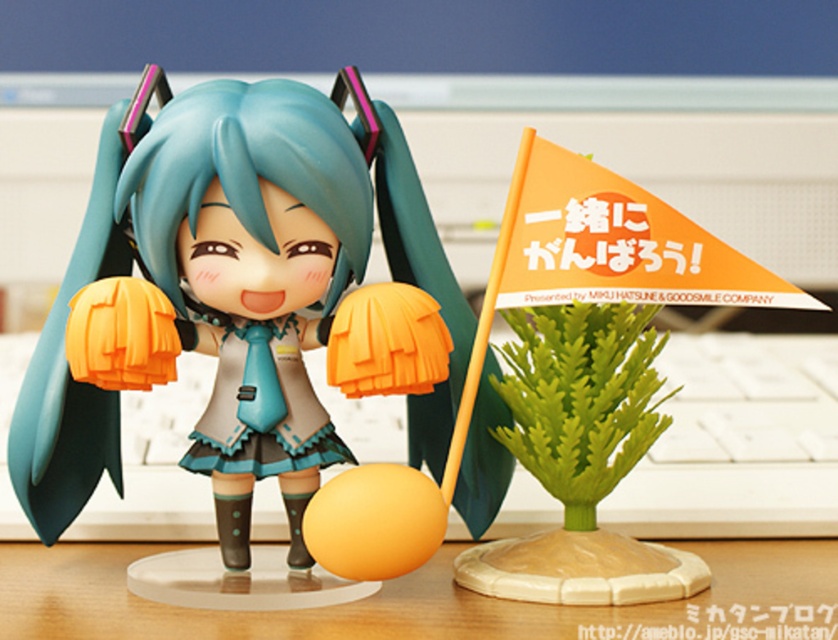
Question: Does matte plastic doll at center have a larger size compared to wooden table at center?

Choices:
 (A) no
 (B) yes

Answer: (B)

Question: Observing the image, what is the correct spatial positioning of matte plastic doll at center in reference to wooden table at center?

Choices:
 (A) right
 (B) left

Answer: (B)

Question: Among these points, which one is farthest from the camera?

Choices:
 (A) (76, 346)
 (B) (747, 628)

Answer: (A)

Question: Is matte plastic doll at center to the left of wooden table at center from the viewer's perspective?

Choices:
 (A) no
 (B) yes

Answer: (B)